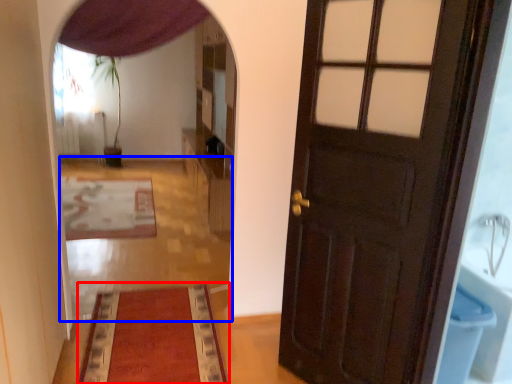
Question: Which object is further to the camera taking this photo, mat (highlighted by a red box) or path (highlighted by a blue box)?

Choices:
 (A) mat
 (B) path

Answer: (B)